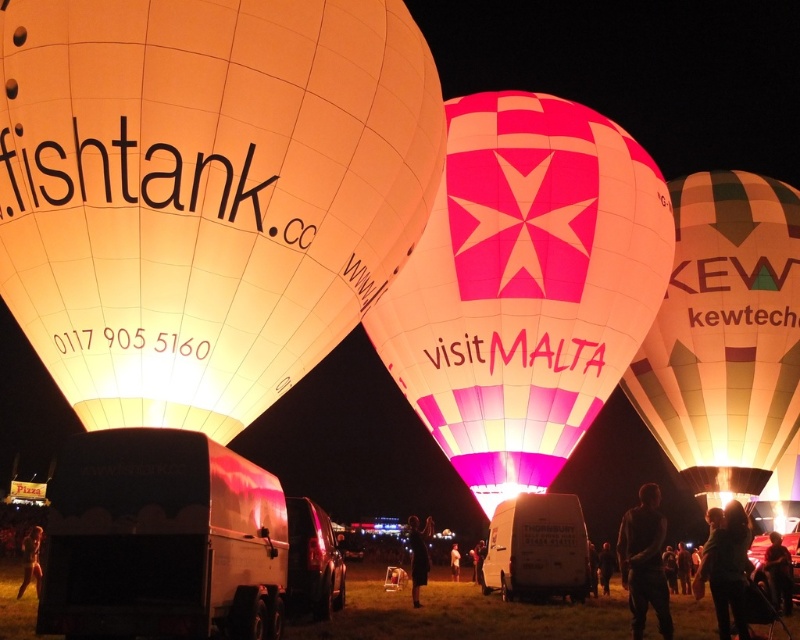
Between point (138, 344) and point (458, 573), which one is positioned in front?

Point (138, 344) is more forward.

Can you confirm if matte white balloon at upper left is taller than light brown leather jacket at center?

Indeed, matte white balloon at upper left has a greater height compared to light brown leather jacket at center.

Which is in front, point (121, 70) or point (458, 556)?

Positioned in front is point (121, 70).

Find the location of `matte white balloon at upper left`. matte white balloon at upper left is located at coordinates (206, 193).

Who is taller, dark hair at lower right or light brown leather jacket at center?

dark hair at lower right is taller.

From the picture: Between dark hair at lower right and light brown leather jacket at center, which one has less height?

With less height is light brown leather jacket at center.

What do you see at coordinates (728, 568) in the screenshot?
I see `dark hair at lower right` at bounding box center [728, 568].

Locate an element on the screen. dark hair at lower right is located at coordinates (728, 568).

Between matte white balloon at upper left and dark hair at lower center, which one has more height?

matte white balloon at upper left

Describe the element at coordinates (206, 193) in the screenshot. I see `matte white balloon at upper left` at that location.

Identify the location of matte white balloon at upper left. (206, 193).